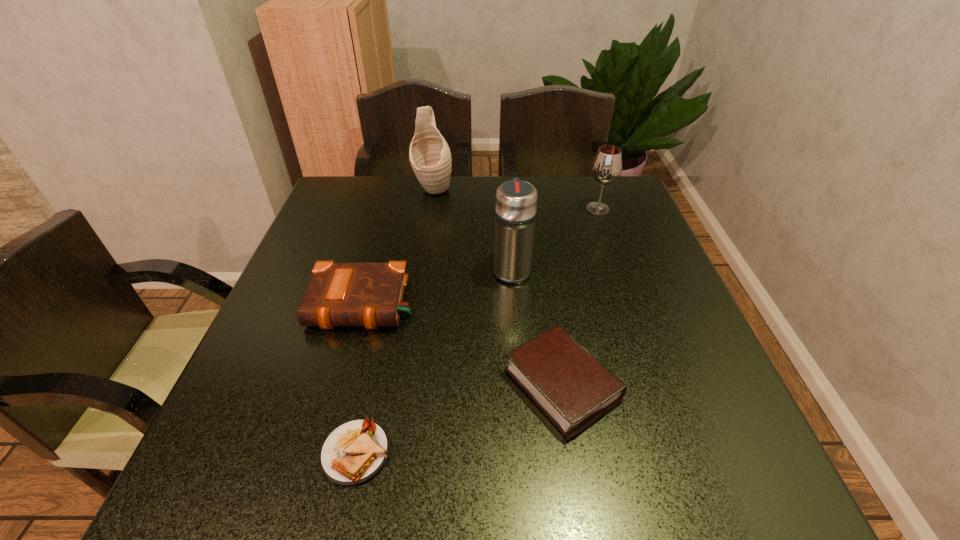
I want to click on vacant region located with a handle on the side of the thermos bottle, so click(x=506, y=195).

Locate an element on the screen. The width and height of the screenshot is (960, 540). blank space located 0.290m with a handle on the side of the thermos bottle is located at coordinates (506, 194).

In order to click on vacant space situated 0.340m with a handle on the side of the thermos bottle in this screenshot , I will do `click(505, 185)`.

Where is `free location located 0.090m on the front of the rightmost object`? free location located 0.090m on the front of the rightmost object is located at coordinates (608, 236).

Where is `vacant space situated on the spine side of the farther Bible`? Image resolution: width=960 pixels, height=540 pixels. vacant space situated on the spine side of the farther Bible is located at coordinates (348, 361).

Find the location of `vacant space located 0.090m on the back of the right Bible`. vacant space located 0.090m on the back of the right Bible is located at coordinates (550, 307).

In order to click on vacant area located 0.090m on the right of the shortest object in this screenshot , I will do `click(444, 453)`.

Image resolution: width=960 pixels, height=540 pixels. What are the coordinates of `pitcher present at the far edge` in the screenshot? It's located at (430, 157).

Locate an element on the screen. This screenshot has height=540, width=960. wineglass at the far edge is located at coordinates (606, 167).

I want to click on object present at the near edge, so click(355, 451).